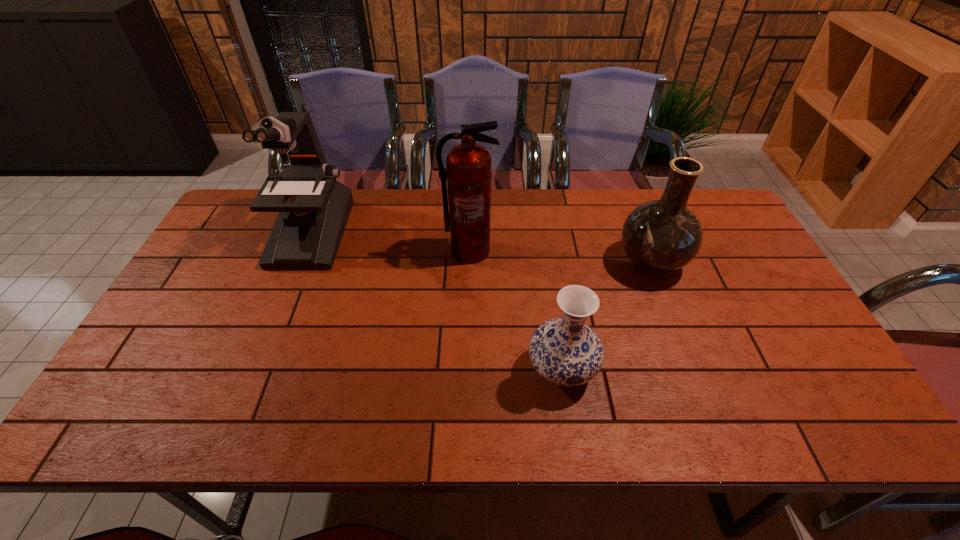
Image resolution: width=960 pixels, height=540 pixels. What are the coordinates of `free spot between the shorter vase and the fire extinguisher` in the screenshot? It's located at (516, 310).

Identify the location of empty location between the second object from right to left and the leftmost object. The width and height of the screenshot is (960, 540). (436, 301).

This screenshot has height=540, width=960. I want to click on vacant area that lies between the shorter vase and the right vase, so click(607, 316).

I want to click on free space between the fire extinguisher and the taller vase, so click(x=561, y=256).

Where is `vacant space that is in between the farther vase and the fire extinguisher`? This screenshot has width=960, height=540. vacant space that is in between the farther vase and the fire extinguisher is located at coordinates tap(561, 256).

What are the coordinates of `the third closest object to the rightmost object` in the screenshot? It's located at (314, 207).

The width and height of the screenshot is (960, 540). Find the location of `object that is the second nearest to the nearer vase`. object that is the second nearest to the nearer vase is located at coordinates (468, 173).

Where is `free location that satisfies the following two spatial constraints: 1. on the back side of the rightmost object; 2. on the right side of the shorter vase`? Image resolution: width=960 pixels, height=540 pixels. free location that satisfies the following two spatial constraints: 1. on the back side of the rightmost object; 2. on the right side of the shorter vase is located at coordinates (545, 262).

Where is `free region that satisfies the following two spatial constraints: 1. on the nozzle side of the fire extinguisher; 2. on the left side of the right vase`? The height and width of the screenshot is (540, 960). free region that satisfies the following two spatial constraints: 1. on the nozzle side of the fire extinguisher; 2. on the left side of the right vase is located at coordinates (469, 262).

This screenshot has width=960, height=540. In order to click on free space that satisfies the following two spatial constraints: 1. on the nozzle side of the nearest object; 2. on the left side of the second object from left to right in this screenshot , I will do `click(467, 369)`.